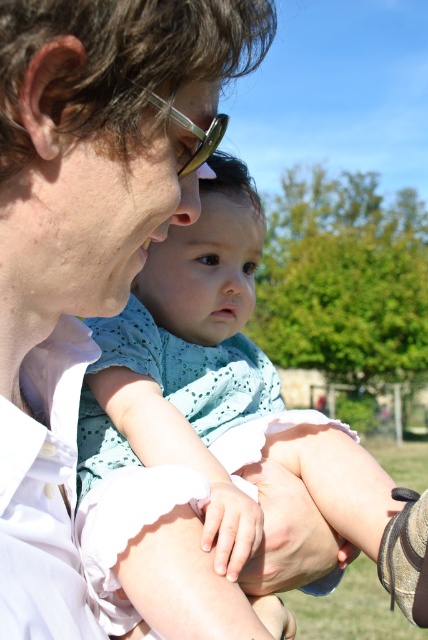
Question: Is the position of matte white shirt at center less distant than that of light blue fabric at center?

Choices:
 (A) yes
 (B) no

Answer: (A)

Question: Can you confirm if light blue fabric at center is bigger than pale skin hand at center?

Choices:
 (A) no
 (B) yes

Answer: (B)

Question: Which object is the closest to the light blue fabric dress at center?

Choices:
 (A) light blue fabric at center
 (B) matte white shirt at center
 (C) pale skin hand at center

Answer: (A)

Question: Which object is positioned farthest from the matte white shirt at center?

Choices:
 (A) light blue fabric at center
 (B) light blue fabric dress at center

Answer: (B)

Question: Does light blue fabric dress at center have a larger size compared to pale skin hand at center?

Choices:
 (A) no
 (B) yes

Answer: (B)

Question: Which object is positioned farthest from the matte white shirt at center?

Choices:
 (A) pale skin hand at center
 (B) light blue fabric at center

Answer: (A)